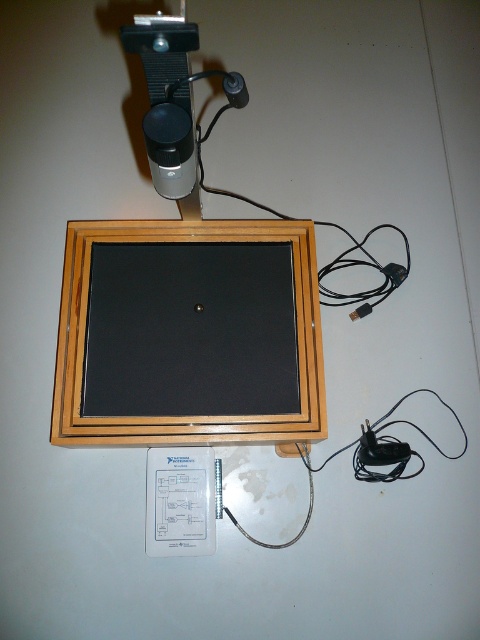
Can you confirm if wooden frame at center is positioned below black plastic plug at upper center?

Correct, wooden frame at center is located below black plastic plug at upper center.

Does wooden frame at center have a lesser width compared to black plastic plug at upper center?

In fact, wooden frame at center might be wider than black plastic plug at upper center.

At what (x,y) coordinates should I click in order to perform the action: click on wooden frame at center. Please return your answer as a coordinate pair (x, y). The height and width of the screenshot is (640, 480). Looking at the image, I should click on (189, 333).